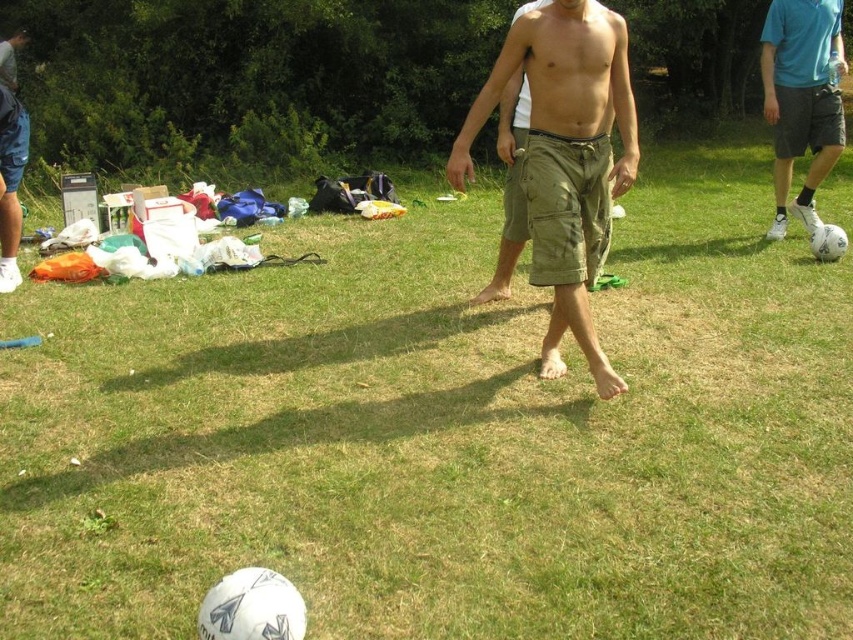
You are standing at the center of the grassy field and see the white matte soccer ball at right. If you walk straight ahead, will you reach the soccer ball before the man in olive green cargo shorts?

The white matte soccer ball at right is located at point (801, 99). Since you are at the center, walking straight ahead would not lead you directly to the soccer ball. The man in olive green cargo shorts is in the midground, closer to you, so you would reach him before the soccer ball.

You are standing at the position of the viewer and want to throw a small pebble to hit the khaki cotton shorts at center. What is the approximate distance you need to throw the pebble?

The khaki cotton shorts at center and viewer are 3.57 meters apart from each other, so you need to throw the pebble approximately 3.57 meters to reach the khaki cotton shorts at center.

You are standing at the origin point in the image. The khaki cotton shorts at center is represented by point (566, 157). Which direction should you move to reach the khaki cotton shorts at center?

The khaki cotton shorts at center is located at point (566, 157), so you should move towards that coordinate to reach it.